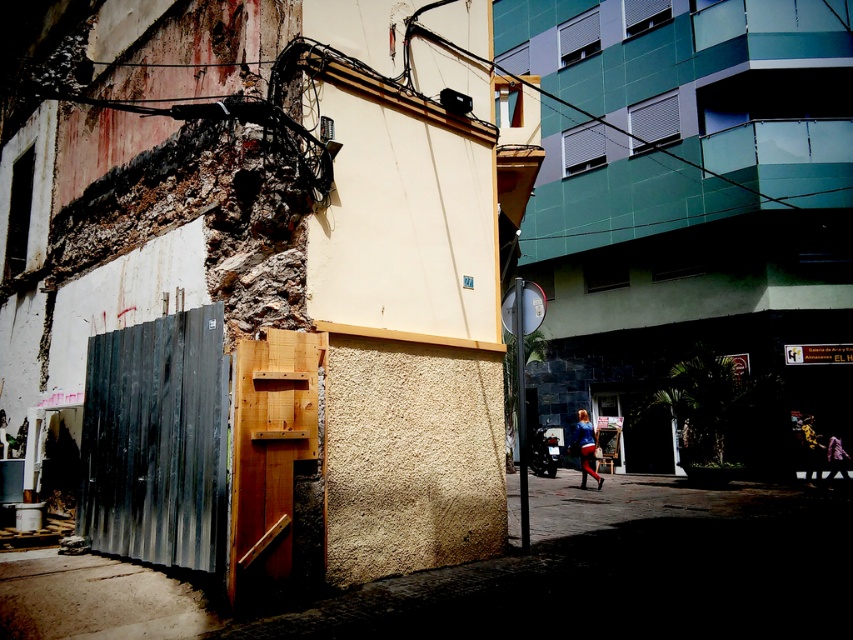
Question: In this image, where is metallic gold helmet at center located relative to leather jacket at center?

Choices:
 (A) right
 (B) left

Answer: (B)

Question: Considering the real-world distances, which object is closest to the leather jacket at center?

Choices:
 (A) blue fabric skirt at lower center
 (B) metallic gold helmet at center

Answer: (B)

Question: Based on their relative distances, which object is nearer to the metallic gold helmet at center?

Choices:
 (A) blue fabric skirt at lower center
 (B) leather jacket at center

Answer: (B)

Question: Is blue fabric skirt at lower center further to camera compared to metallic gold helmet at center?

Choices:
 (A) no
 (B) yes

Answer: (A)

Question: Can you confirm if blue fabric skirt at lower center is bigger than leather jacket at center?

Choices:
 (A) no
 (B) yes

Answer: (B)

Question: Which point is closer to the camera?

Choices:
 (A) blue fabric skirt at lower center
 (B) leather jacket at center
 (C) metallic gold helmet at center

Answer: (A)